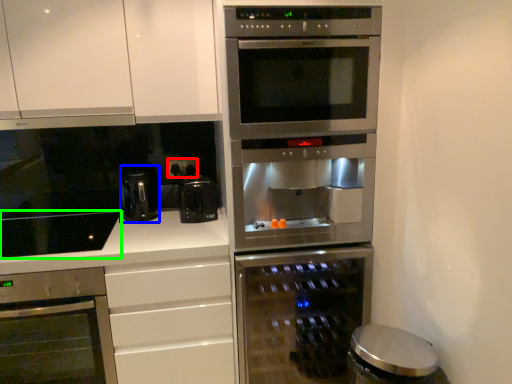
Question: Based on their relative distances, which object is farther from electric outlet (highlighted by a red box)? Choose from coffee machine (highlighted by a blue box) and gas stove (highlighted by a green box).

Choices:
 (A) coffee machine
 (B) gas stove

Answer: (B)